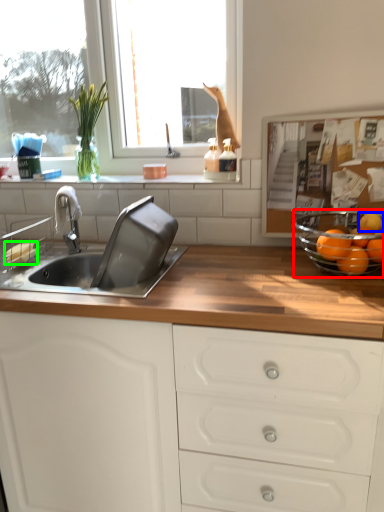
Question: Which object is positioned closest to glass bowl (highlighted by a red box)? Select from orange (highlighted by a blue box) and food (highlighted by a green box).

Choices:
 (A) orange
 (B) food

Answer: (A)